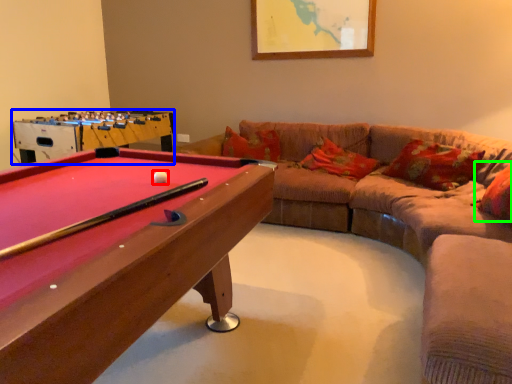
Question: Which object is the farthest from ball (highlighted by a red box)? Choose among these: table (highlighted by a blue box) or pillow (highlighted by a green box).

Choices:
 (A) table
 (B) pillow

Answer: (A)